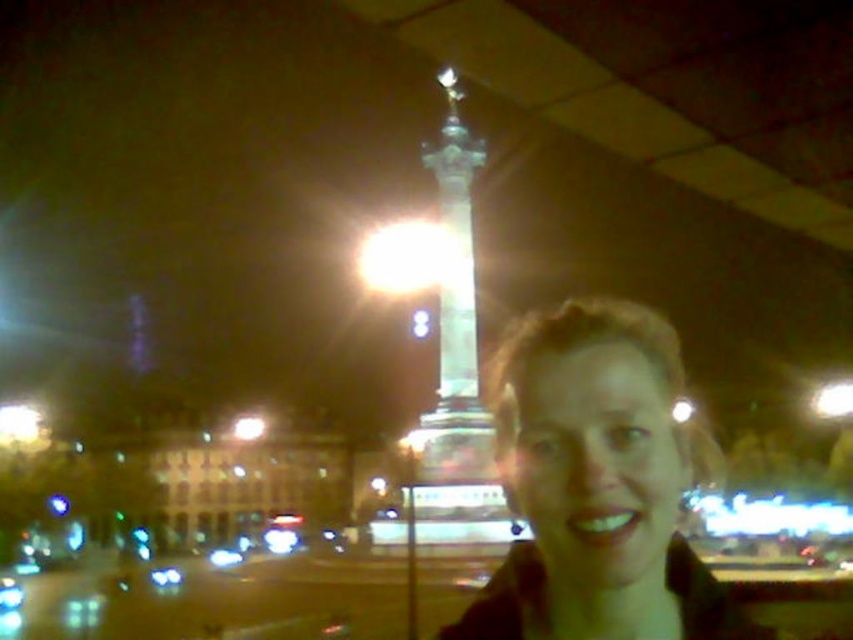
Consider the image. You are a photographer who just took a photo of a person in a moving vehicle at night. You want to ensure that the person is clearly visible. The photo has a point labeled as point (596, 484). What does this point represent in the photo?

The point (596, 484) corresponds to the matte brown hair at center, which is part of the person in the photo.

You are a photographer trying to capture a clear shot of the shiny metallic column at center. However, the matte brown hair at center is blocking your view. From which side should you move the camera to get a better angle?

Since the matte brown hair at center is to the right of the shiny metallic column at center, you should move the camera to the left to position the column in a clearer view without the obstruction.